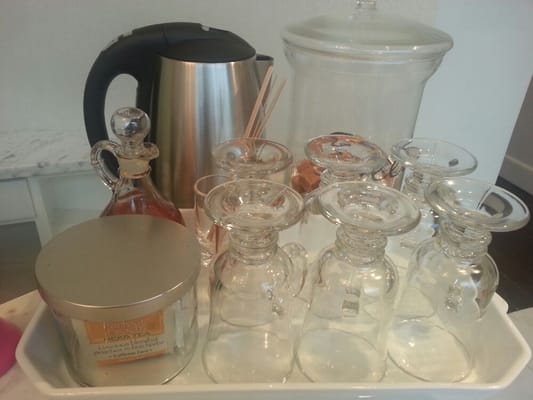
Where is `glass top`? glass top is located at coordinates (129, 125).